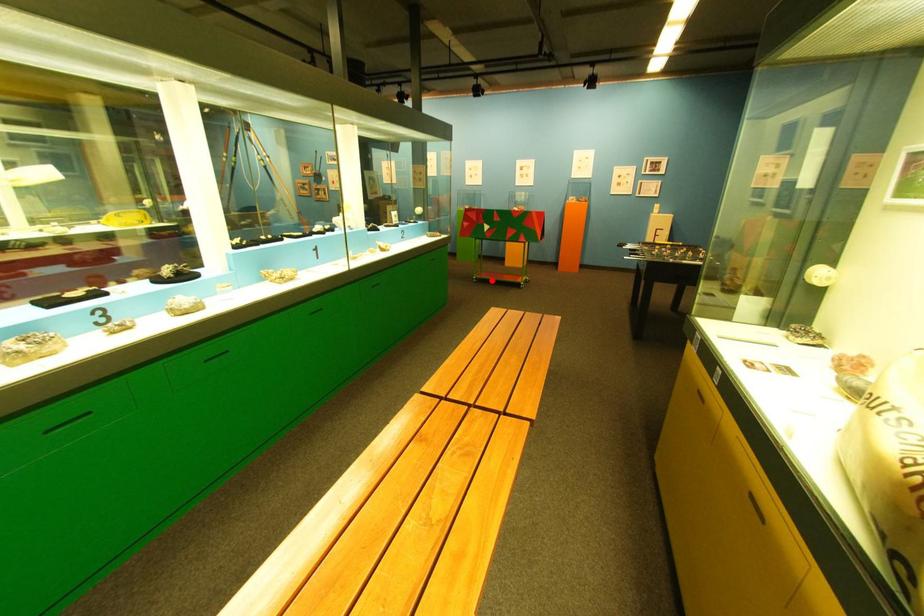
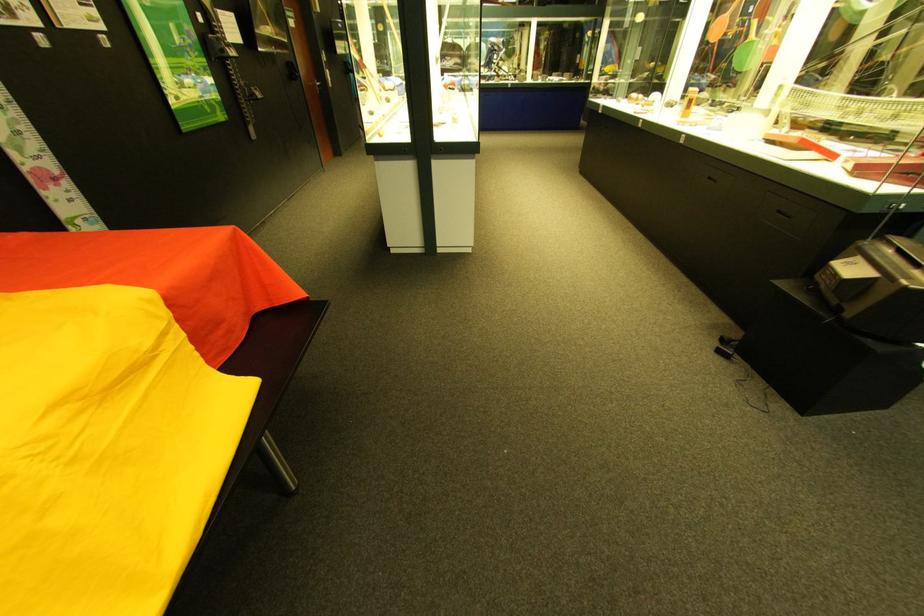
Question: I am providing you with two images of the same scene from different viewpoints. A red point is marked on the first image. At the location where the point appears in image 1, is it still visible in image 2?

Choices:
 (A) Yes
 (B) No

Answer: (B)